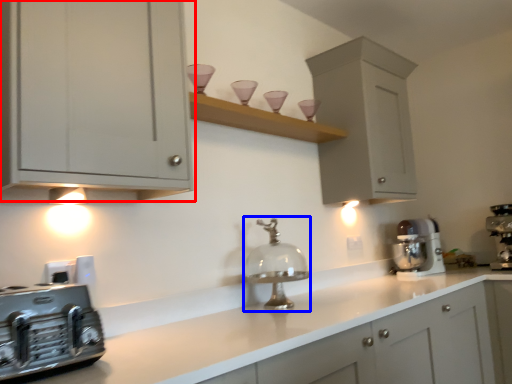
Question: Which of the following is the farthest to the observer, cabinetry (highlighted by a red box) or faucet (highlighted by a blue box)?

Choices:
 (A) cabinetry
 (B) faucet

Answer: (B)